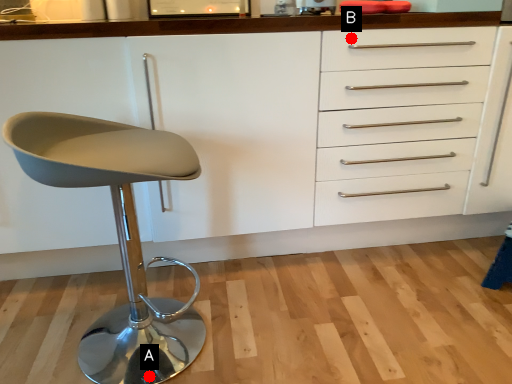
Question: Two points are circled on the image, labeled by A and B beside each circle. Which point is farther to the camera?

Choices:
 (A) A is further
 (B) B is further

Answer: (B)